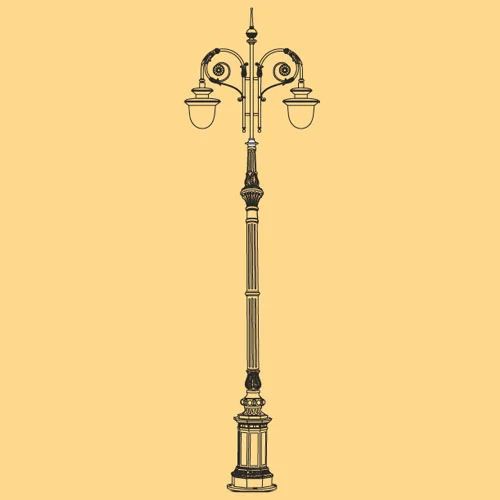
Find the location of a particular element. The image size is (500, 500). rounded light covers is located at coordinates (195, 115), (301, 119).